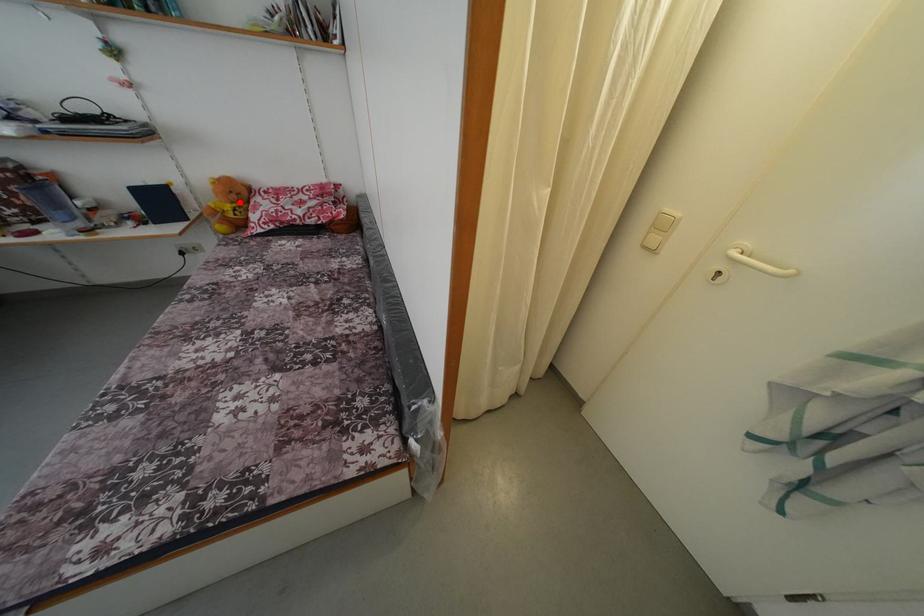
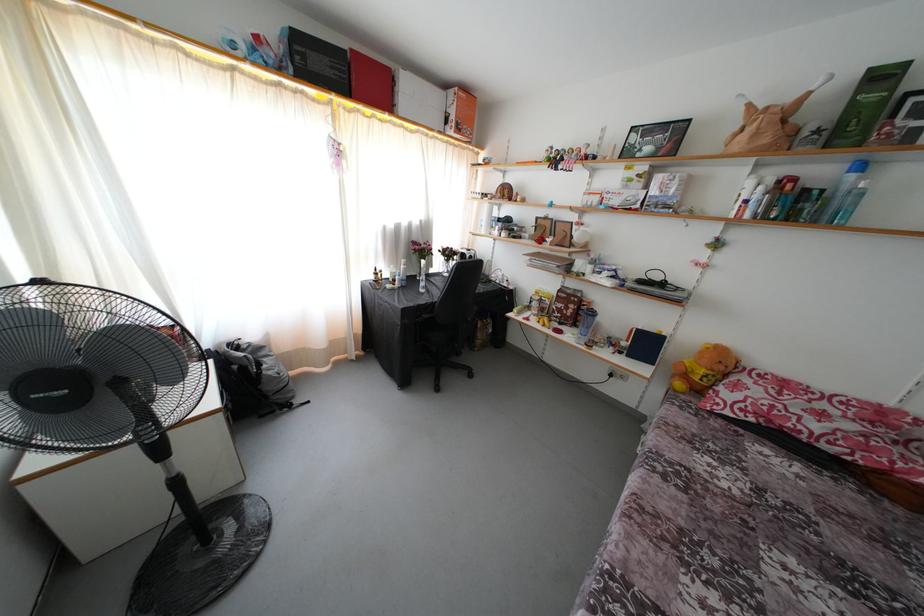
Where in the second image is the point corresponding to the highlighted location from the first image?

(726, 373)